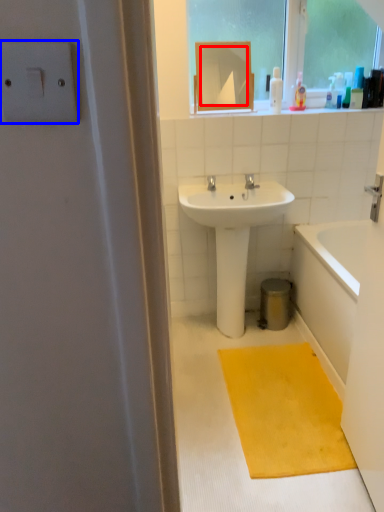
Question: Which object appears closest to the camera in this image, mirror (highlighted by a red box) or light switch (highlighted by a blue box)?

Choices:
 (A) mirror
 (B) light switch

Answer: (B)